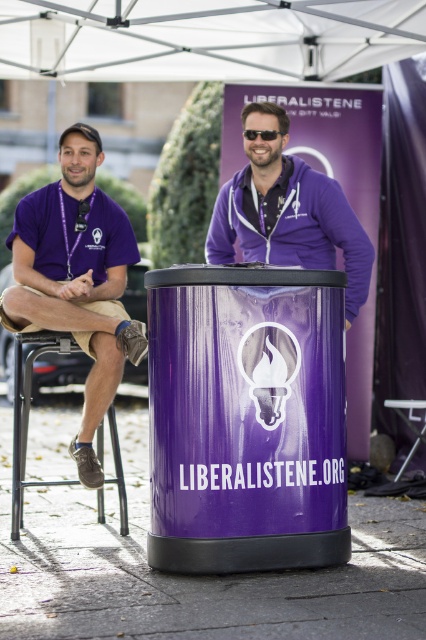
Question: Can you confirm if purple matte jacket at center is positioned below metallic silver stool at lower right?

Choices:
 (A) yes
 (B) no

Answer: (B)

Question: Which of these objects is positioned farthest from the sunglasses at center?

Choices:
 (A) purple matte jacket at center
 (B) white fabric canopy at upper center
 (C) matte purple shirt at left
 (D) metallic black chair at lower left

Answer: (B)

Question: Which is farther from the purple matte jacket at center?

Choices:
 (A) metallic silver stool at lower right
 (B) metallic black chair at lower left
 (C) white fabric canopy at upper center
 (D) sunglasses at center

Answer: (A)

Question: Which of the following is the farthest from the observer?

Choices:
 (A) sunglasses at center
 (B) white fabric canopy at upper center
 (C) metallic black chair at lower left

Answer: (B)

Question: From the image, what is the correct spatial relationship of purple matte jacket at center in relation to metallic silver stool at lower right?

Choices:
 (A) left
 (B) right

Answer: (A)

Question: Does white fabric canopy at upper center have a smaller size compared to metallic black chair at lower left?

Choices:
 (A) no
 (B) yes

Answer: (A)